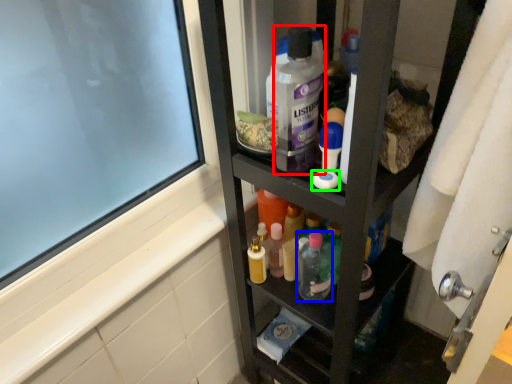
Question: Estimate the real-world distances between objects in this image. Which object is farther from cleaning product (highlighted by a red box), toiletry (highlighted by a blue box) or soap (highlighted by a green box)?

Choices:
 (A) toiletry
 (B) soap

Answer: (A)